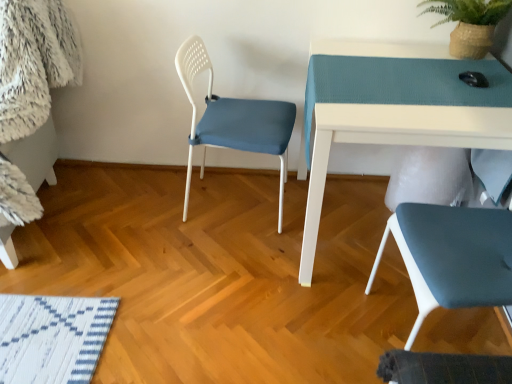
You are a GUI agent. You are given a task and a screenshot of the screen. Output one action in this format:
    pyautogui.click(x=<x>, y=<y>)
    Task: Click on the white glossy table at upper right
    The width and height of the screenshot is (512, 384).
    Given the screenshot: What is the action you would take?
    pyautogui.click(x=393, y=141)

You are a GUI agent. You are given a task and a screenshot of the screen. Output one action in this format:
    pyautogui.click(x=<x>, y=<y>)
    Task: Click on the white plastic chair at center, which is the second chair from right to left
    This screenshot has width=512, height=384.
    Given the screenshot: What is the action you would take?
    pyautogui.click(x=233, y=120)

Measure the distance between point (504, 256) and camera.

Point (504, 256) is 4.06 feet away from camera.

What are the coordinates of `white glossy table at upper right` in the screenshot? It's located at (393, 141).

From their relative heights in the image, would you say green woven basket at upper right is taller or shorter than white plastic chair at center, which is the second chair from right to left?

Clearly, green woven basket at upper right is shorter compared to white plastic chair at center, which is the second chair from right to left.

Relative to white plastic chair at center, acting as the first chair starting from the left, is green woven basket at upper right in front or behind?

Clearly, green woven basket at upper right is behind white plastic chair at center, acting as the first chair starting from the left.

Is green woven basket at upper right looking in the opposite direction of white plastic chair at center, which is the second chair from right to left?

No, white plastic chair at center, which is the second chair from right to left, is not at the back of green woven basket at upper right.

Is green woven basket at upper right bigger or smaller than white plastic chair at center, which is the second chair from right to left?

Clearly, green woven basket at upper right is smaller in size than white plastic chair at center, which is the second chair from right to left.

Are matte blue chair at lower right, placed as the 1th chair when sorted from right to left, and green woven basket at upper right beside each other?

No, matte blue chair at lower right, placed as the 1th chair when sorted from right to left, is not beside green woven basket at upper right.

Is matte blue chair at lower right, placed as the 1th chair when sorted from right to left, completely or partially outside of green woven basket at upper right?

Indeed, matte blue chair at lower right, placed as the 1th chair when sorted from right to left, is completely outside green woven basket at upper right.

From the picture: From the image's perspective, is matte blue chair at lower right, which appears as the second chair when viewed from the left, on green woven basket at upper right?

No, from the image's perspective, matte blue chair at lower right, which appears as the second chair when viewed from the left, is not above green woven basket at upper right.

Is white glossy table at upper right inside the boundaries of matte blue chair at lower right, which appears as the second chair when viewed from the left, or outside?

white glossy table at upper right cannot be found inside matte blue chair at lower right, which appears as the second chair when viewed from the left.

In terms of width, does white glossy table at upper right look wider or thinner when compared to matte blue chair at lower right, placed as the 1th chair when sorted from right to left?

white glossy table at upper right is wider than matte blue chair at lower right, placed as the 1th chair when sorted from right to left.

In the scene shown: From the image's perspective, which one is positioned higher, white glossy table at upper right or matte blue chair at lower right, which appears as the second chair when viewed from the left?

white glossy table at upper right, from the image's perspective.

Considering the relative sizes of matte blue chair at lower right, which appears as the second chair when viewed from the left, and white plastic chair at center, acting as the first chair starting from the left, in the image provided, is matte blue chair at lower right, which appears as the second chair when viewed from the left, wider than white plastic chair at center, acting as the first chair starting from the left,?

Incorrect, the width of matte blue chair at lower right, which appears as the second chair when viewed from the left, does not surpass that of white plastic chair at center, acting as the first chair starting from the left.

Could you measure the distance between matte blue chair at lower right, placed as the 1th chair when sorted from right to left, and white plastic chair at center, which is the second chair from right to left?

matte blue chair at lower right, placed as the 1th chair when sorted from right to left, and white plastic chair at center, which is the second chair from right to left, are 30.75 inches apart from each other.

Which is closer to the camera, (410, 267) or (200, 120)?

Clearly, point (410, 267) is closer to the camera than point (200, 120).

From the image's perspective, who appears lower, matte blue chair at lower right, which appears as the second chair when viewed from the left, or white plastic chair at center, acting as the first chair starting from the left?

From the image's view, matte blue chair at lower right, which appears as the second chair when viewed from the left, is below.

From the image's perspective, which object appears higher, matte blue chair at lower right, which appears as the second chair when viewed from the left, or white glossy table at upper right?

From the image's view, white glossy table at upper right is above.

Where is `table located on the left of matte blue chair at lower right, placed as the 1th chair when sorted from right to left`? table located on the left of matte blue chair at lower right, placed as the 1th chair when sorted from right to left is located at coordinates pos(393,141).

In terms of width, does matte blue chair at lower right, which appears as the second chair when viewed from the left, look wider or thinner when compared to white glossy table at upper right?

In the image, matte blue chair at lower right, which appears as the second chair when viewed from the left, appears to be more narrow than white glossy table at upper right.

Is matte blue chair at lower right, placed as the 1th chair when sorted from right to left, shorter than white glossy table at upper right?

In fact, matte blue chair at lower right, placed as the 1th chair when sorted from right to left, may be taller than white glossy table at upper right.

From the image's perspective, is green woven basket at upper right located above or below matte blue chair at lower right, which appears as the second chair when viewed from the left?

From the image's perspective, green woven basket at upper right appears above matte blue chair at lower right, which appears as the second chair when viewed from the left.

From the picture: Is green woven basket at upper right facing away from matte blue chair at lower right, which appears as the second chair when viewed from the left?

green woven basket at upper right is not turned away from matte blue chair at lower right, which appears as the second chair when viewed from the left.

Measure the distance between green woven basket at upper right and matte blue chair at lower right, which appears as the second chair when viewed from the left.

green woven basket at upper right is 33.10 inches away from matte blue chair at lower right, which appears as the second chair when viewed from the left.

Is the position of green woven basket at upper right more distant than that of matte blue chair at lower right, which appears as the second chair when viewed from the left?

Yes, it is behind matte blue chair at lower right, which appears as the second chair when viewed from the left.

Is white plastic chair at center, acting as the first chair starting from the left, positioned far away from matte blue chair at lower right, which appears as the second chair when viewed from the left?

Actually, white plastic chair at center, acting as the first chair starting from the left, and matte blue chair at lower right, which appears as the second chair when viewed from the left, are a little close together.

Does point (219, 138) appear closer or farther from the camera than point (395, 223)?

Point (219, 138) is positioned farther from the camera compared to point (395, 223).

How far apart are white plastic chair at center, which is the second chair from right to left, and matte blue chair at lower right, which appears as the second chair when viewed from the left?

They are 30.75 inches apart.

From the image's perspective, starting from the green woven basket at upper right, which chair is the 1st one below? Please provide its 2D coordinates.

[(233, 120)]

The width and height of the screenshot is (512, 384). Find the location of `plant above the matte blue chair at lower right, placed as the 1th chair when sorted from right to left (from a real-world perspective)`. plant above the matte blue chair at lower right, placed as the 1th chair when sorted from right to left (from a real-world perspective) is located at coordinates click(469, 23).

Consider the image. Based on their spatial positions, is matte blue chair at lower right, placed as the 1th chair when sorted from right to left, or white glossy table at upper right further from green woven basket at upper right?

matte blue chair at lower right, placed as the 1th chair when sorted from right to left, is positioned further to the anchor green woven basket at upper right.

Considering their positions, is white glossy table at upper right positioned closer to white plastic chair at center, acting as the first chair starting from the left, than matte blue chair at lower right, placed as the 1th chair when sorted from right to left?

white glossy table at upper right lies closer to white plastic chair at center, acting as the first chair starting from the left, than the other object.

Based on their spatial positions, is white glossy table at upper right or green woven basket at upper right further from white plastic chair at center, acting as the first chair starting from the left?

Among the two, green woven basket at upper right is located further to white plastic chair at center, acting as the first chair starting from the left.

Which object lies further to the anchor point green woven basket at upper right, white plastic chair at center, acting as the first chair starting from the left, or matte blue chair at lower right, which appears as the second chair when viewed from the left?

white plastic chair at center, acting as the first chair starting from the left, is further to green woven basket at upper right.

In the scene shown: Which object lies further to the anchor point matte blue chair at lower right, which appears as the second chair when viewed from the left, green woven basket at upper right or white glossy table at upper right?

green woven basket at upper right lies further to matte blue chair at lower right, which appears as the second chair when viewed from the left, than the other object.

From the picture: Based on their spatial positions, is white plastic chair at center, acting as the first chair starting from the left, or green woven basket at upper right further from matte blue chair at lower right, which appears as the second chair when viewed from the left?

Based on the image, green woven basket at upper right appears to be further to matte blue chair at lower right, which appears as the second chair when viewed from the left.

From the image, which object appears to be nearer to white glossy table at upper right, green woven basket at upper right or matte blue chair at lower right, which appears as the second chair when viewed from the left?

matte blue chair at lower right, which appears as the second chair when viewed from the left.

Based on their spatial positions, is white plastic chair at center, acting as the first chair starting from the left, or white glossy table at upper right closer to matte blue chair at lower right, placed as the 1th chair when sorted from right to left?

white glossy table at upper right is closer to matte blue chair at lower right, placed as the 1th chair when sorted from right to left.

At what (x,y) coordinates should I click in order to perform the action: click on table that lies between green woven basket at upper right and matte blue chair at lower right, placed as the 1th chair when sorted from right to left, from top to bottom. Please return your answer as a coordinate pair (x, y). This screenshot has width=512, height=384. Looking at the image, I should click on (393, 141).

Identify the location of table between white plastic chair at center, acting as the first chair starting from the left, and green woven basket at upper right. (393, 141).

Image resolution: width=512 pixels, height=384 pixels. Find the location of `table between white plastic chair at center, acting as the first chair starting from the left, and matte blue chair at lower right, which appears as the second chair when viewed from the left, in the horizontal direction`. table between white plastic chair at center, acting as the first chair starting from the left, and matte blue chair at lower right, which appears as the second chair when viewed from the left, in the horizontal direction is located at coordinates (393, 141).

This screenshot has width=512, height=384. I want to click on chair between white plastic chair at center, acting as the first chair starting from the left, and green woven basket at upper right, so click(x=452, y=256).